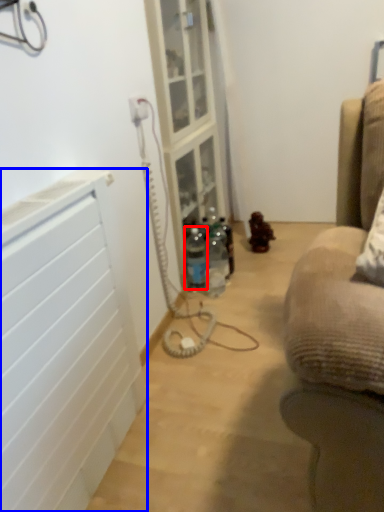
Question: Which of the following is the farthest to the observer, bottle (highlighted by a red box) or radiator (highlighted by a blue box)?

Choices:
 (A) bottle
 (B) radiator

Answer: (A)